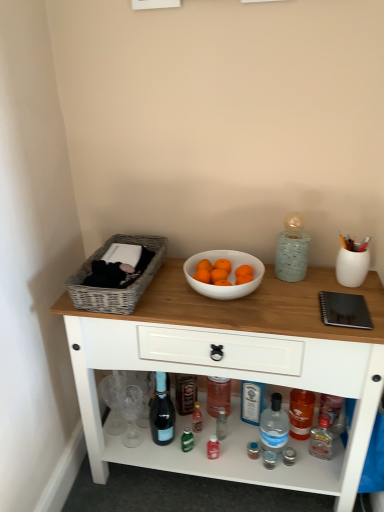
Question: From their relative heights in the image, would you say matte glass bottle at center, placed as the 1th bottle when sorted from left to right, is taller or shorter than woven gray basket at left?

Choices:
 (A) tall
 (B) short

Answer: (A)

Question: Considering their positions, is matte glass bottle at center, placed as the 1th bottle when sorted from left to right, located in front of or behind woven gray basket at left?

Choices:
 (A) front
 (B) behind

Answer: (B)

Question: Estimate the real-world distances between objects in this image. Which object is closer to the wooden table at center?

Choices:
 (A) white glossy bowl at center
 (B) woven gray basket at left
 (C) transparent plastic bottle at lower center, which ranks as the second bottle in left-to-right order
 (D) matte glass bottle at center, placed as the 1th bottle when sorted from left to right

Answer: (A)

Question: Which object is the closest to the matte glass bottle at center, placed as the 1th bottle when sorted from left to right?

Choices:
 (A) woven gray basket at left
 (B) transparent plastic bottle at lower center, placed as the first bottle when sorted from right to left
 (C) white glossy bowl at center
 (D) wooden table at center

Answer: (B)